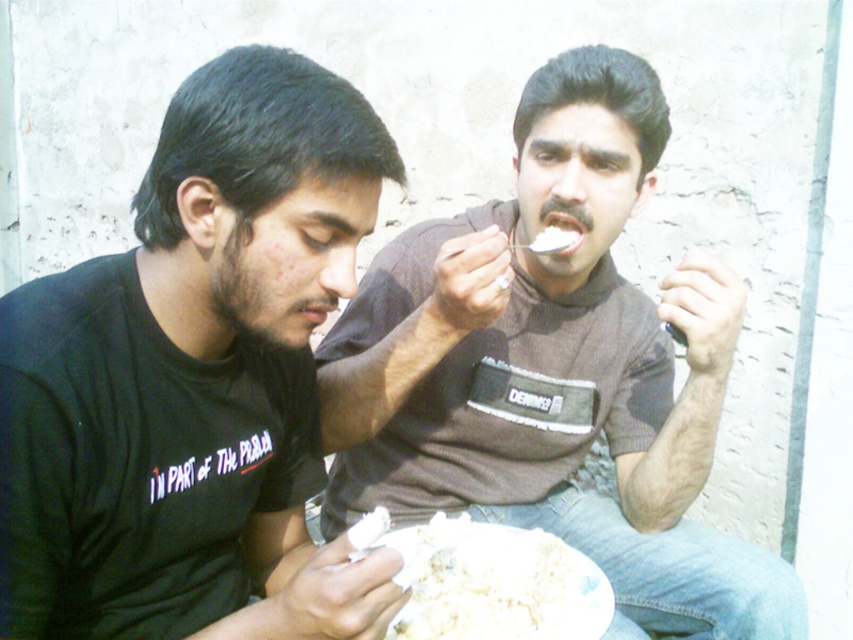
Between point (495, 614) and point (311, 321), which one is positioned behind?

The point (495, 614) is more distant.

Does white fluffy rice at lower center have a lesser width compared to matte black mouth at center?

No.

Between point (390, 541) and point (305, 305), which one is positioned behind?

The point (390, 541) is behind.

The width and height of the screenshot is (853, 640). Identify the location of white fluffy rice at lower center. (494, 582).

Does brown cotton shirt at center have a greater height compared to white fluffy rice at lower center?

Yes, brown cotton shirt at center is taller than white fluffy rice at lower center.

The height and width of the screenshot is (640, 853). Find the location of `brown cotton shirt at center`. brown cotton shirt at center is located at coordinates (554, 371).

Measure the distance between point (x=535, y=317) and camera.

Point (x=535, y=317) is 4.38 feet away from camera.

I want to click on brown cotton shirt at center, so point(554,371).

Who is shorter, white matte teeth at center or matte black mouth at center?

With less height is matte black mouth at center.

Is white matte teeth at center in front of matte black mouth at center?

No, it is behind matte black mouth at center.

Which is behind, point (585, 220) or point (305, 305)?

The point (585, 220) is behind.

Identify the location of white matte teeth at center. (572, 218).